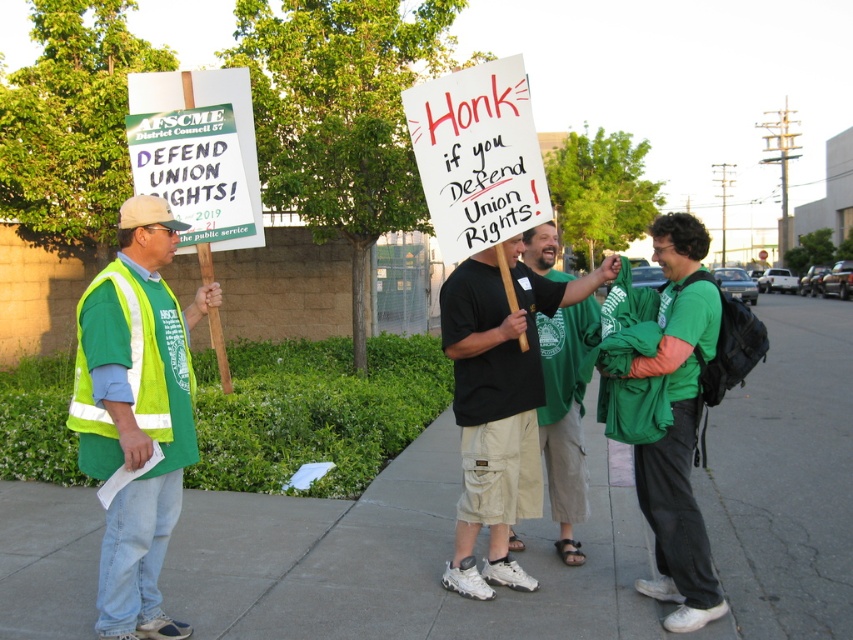
Between green fabric shirt at center and green reflective safety vest at left, which one is positioned higher?

green reflective safety vest at left is above.

This screenshot has height=640, width=853. Describe the element at coordinates (664, 410) in the screenshot. I see `green fabric shirt at center` at that location.

Identify the location of green fabric shirt at center. This screenshot has width=853, height=640. (664, 410).

Is point (132, 481) closer to viewer compared to point (428, 112)?

Yes, it is.

Is reflective yellow vest at left thinner than white paper sign at center?

Yes.

Which is in front, point (165, 340) or point (495, 70)?

Point (165, 340) is more forward.

Where is `reflective yellow vest at left`? The width and height of the screenshot is (853, 640). reflective yellow vest at left is located at coordinates (136, 412).

The width and height of the screenshot is (853, 640). I want to click on black cotton t-shirt at center, so click(x=498, y=404).